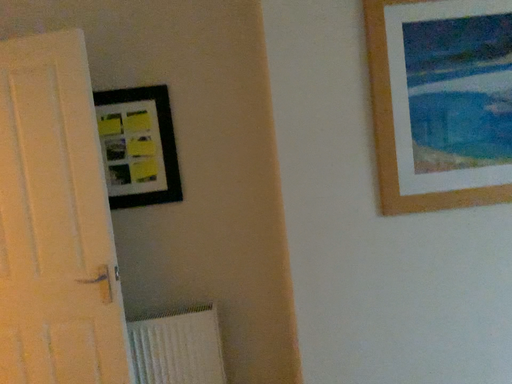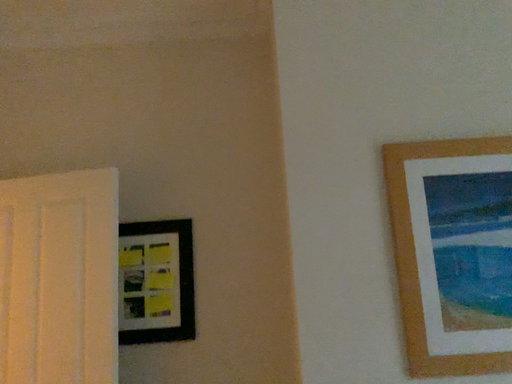
Question: Which way did the camera rotate in the video?

Choices:
 (A) rotated upward
 (B) rotated downward

Answer: (A)